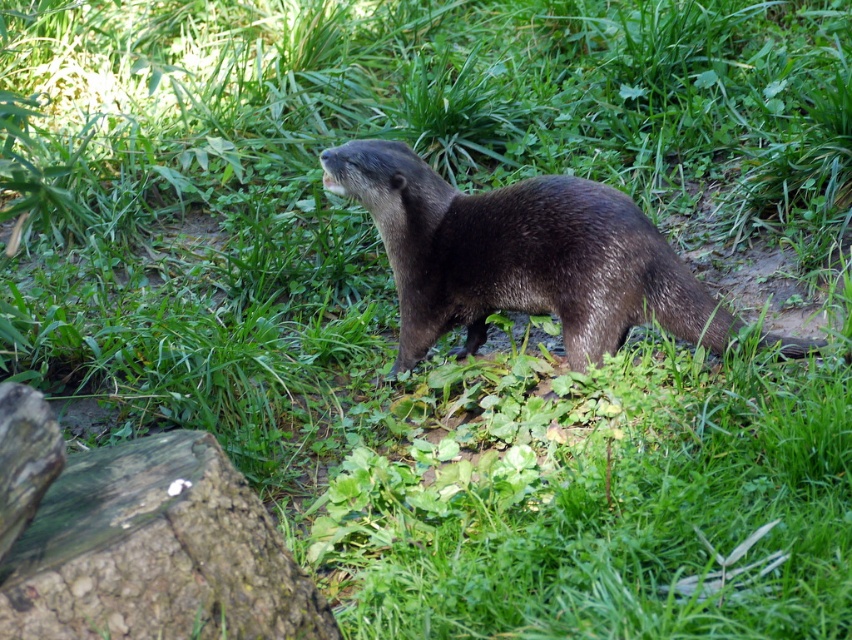
Question: Does shiny brown otter at center appear under weathered brown log at lower left?

Choices:
 (A) yes
 (B) no

Answer: (B)

Question: Can you confirm if shiny brown otter at center is wider than weathered brown log at lower left?

Choices:
 (A) no
 (B) yes

Answer: (B)

Question: Can you confirm if shiny brown otter at center is positioned above weathered brown log at lower left?

Choices:
 (A) yes
 (B) no

Answer: (A)

Question: Which of the following is the closest to the observer?

Choices:
 (A) (609, 188)
 (B) (206, 561)

Answer: (B)